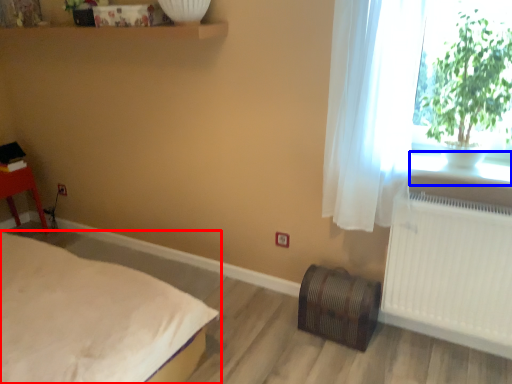
Question: Among these objects, which one is nearest to the camera, bed (highlighted by a red box) or window sill (highlighted by a blue box)?

Choices:
 (A) bed
 (B) window sill

Answer: (A)